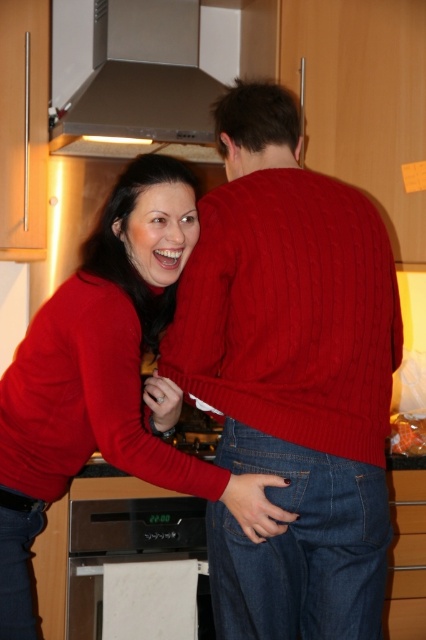
Question: Observing the image, what is the correct spatial positioning of matte red sweater at center in reference to black glossy oven at lower center?

Choices:
 (A) below
 (B) above

Answer: (B)

Question: Estimate the real-world distances between objects in this image. Which object is closer to the satin silver exhaust hood at upper center?

Choices:
 (A) black glossy oven at lower center
 (B) cable-knit sweater at center

Answer: (B)

Question: Can you confirm if cable-knit sweater at center is positioned to the left of satin silver exhaust hood at upper center?

Choices:
 (A) no
 (B) yes

Answer: (A)

Question: Is satin silver exhaust hood at upper center smaller than black glossy oven at lower center?

Choices:
 (A) yes
 (B) no

Answer: (B)

Question: Which of the following is the farthest from the observer?

Choices:
 (A) (92, 627)
 (B) (23, 634)
 (C) (319, 356)
 (D) (193, 54)

Answer: (D)

Question: Among these points, which one is nearest to the camera?

Choices:
 (A) (58, 416)
 (B) (120, 547)
 (C) (270, 584)

Answer: (C)